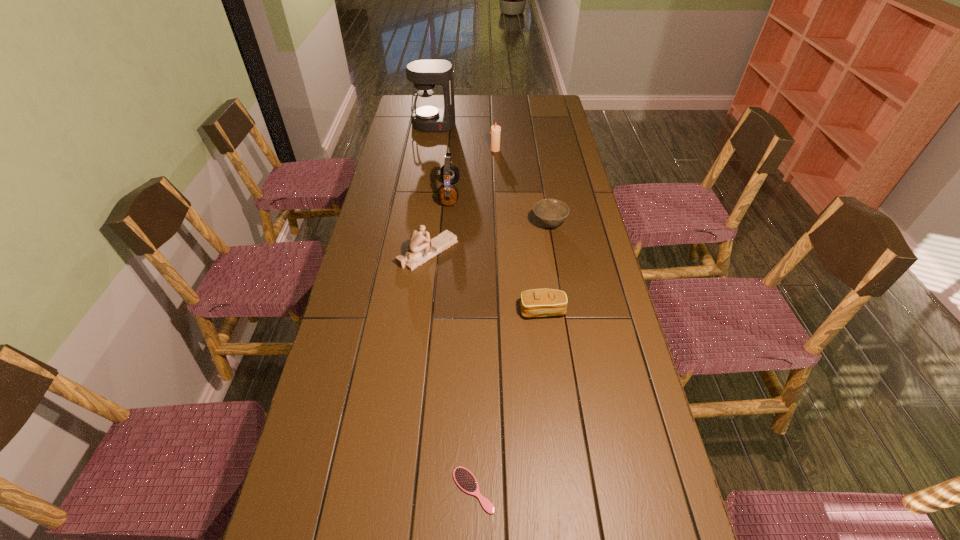
Identify the location of object present at the right edge. (550, 213).

Find the location of a particular element. This screenshot has width=960, height=540. blank space at the far edge of the desktop is located at coordinates (464, 97).

Find the location of a particular element. vacant space at the left edge of the desktop is located at coordinates (394, 134).

Identify the location of free space at the right edge. (563, 195).

The width and height of the screenshot is (960, 540). What are the coordinates of `free space at the far right corner of the desktop` in the screenshot? It's located at (537, 112).

Identify the location of free space between the figurine and the clutch bag. The height and width of the screenshot is (540, 960). pyautogui.click(x=486, y=281).

This screenshot has height=540, width=960. Find the location of `empty space that is in between the figurine and the sixth farthest object`. empty space that is in between the figurine and the sixth farthest object is located at coordinates (486, 281).

Image resolution: width=960 pixels, height=540 pixels. I want to click on free space that is in between the sixth farthest object and the sixth nearest object, so click(x=519, y=231).

Locate an element on the screen. This screenshot has width=960, height=540. unoccupied position between the figurine and the clutch bag is located at coordinates (486, 281).

Find the location of a particular element. The height and width of the screenshot is (540, 960). object that is the sixth nearest to the bowl is located at coordinates (465, 480).